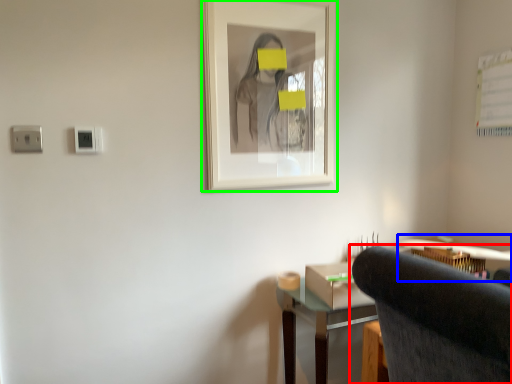
Question: Which is farther away from chair (highlighted by a red box)? computer desk (highlighted by a blue box) or picture frame (highlighted by a green box)?

Choices:
 (A) computer desk
 (B) picture frame

Answer: (A)